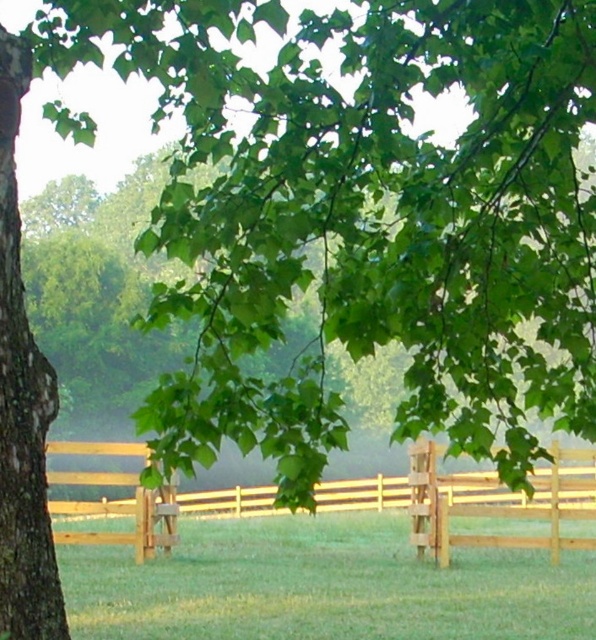
Can you confirm if light brown wooden fence at center is thinner than brown wooden fence at lower right?

Incorrect, light brown wooden fence at center's width is not less than brown wooden fence at lower right's.

Between light brown wooden fence at center and brown wooden fence at lower right, which one appears on the left side from the viewer's perspective?

light brown wooden fence at center

Identify the location of light brown wooden fence at center. (473, 500).